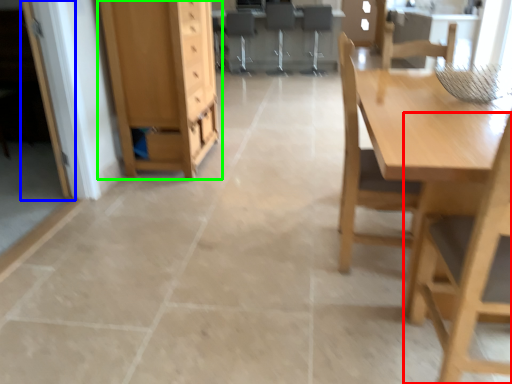
Question: Which is nearer to the chair (highlighted by a red box)? glass door (highlighted by a blue box) or cabinetry (highlighted by a green box).

Choices:
 (A) glass door
 (B) cabinetry

Answer: (B)